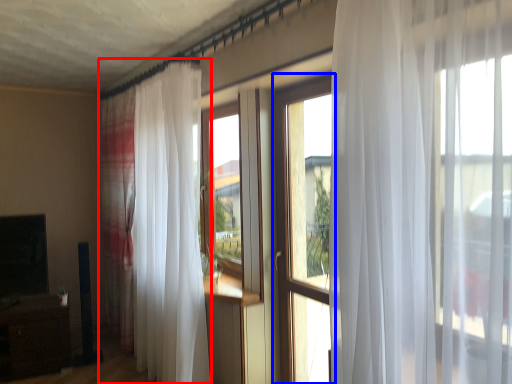
Question: Among these objects, which one is nearest to the camera, curtain (highlighted by a red box) or window (highlighted by a blue box)?

Choices:
 (A) curtain
 (B) window

Answer: (B)